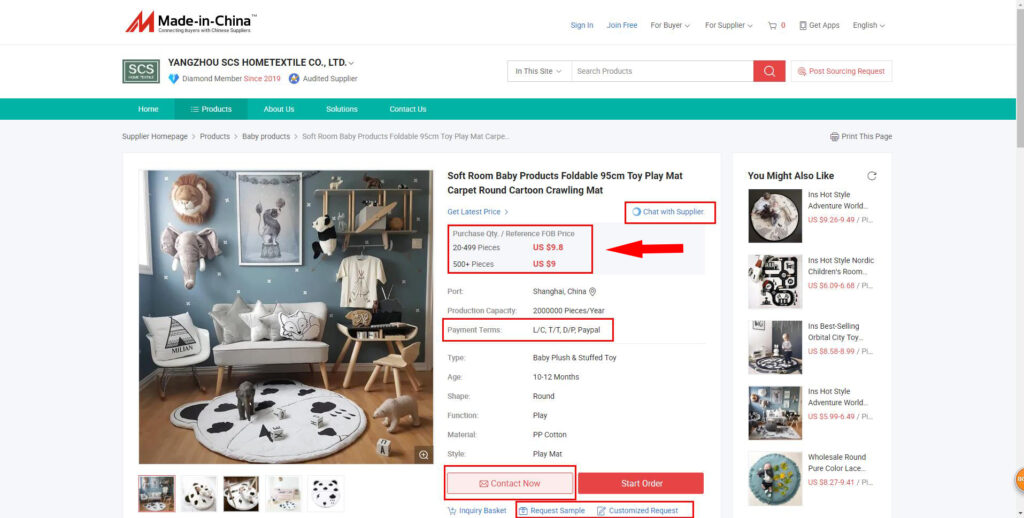
Locate an element on the screen. 5 photos of room shown in large image is located at coordinates (150, 498), (195, 498), (237, 497), (282, 491), (324, 491).